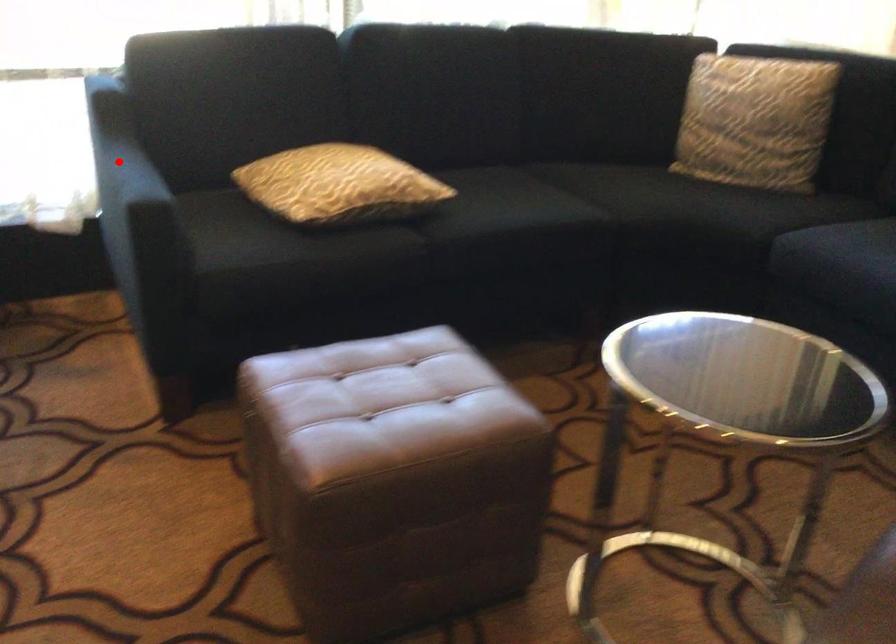
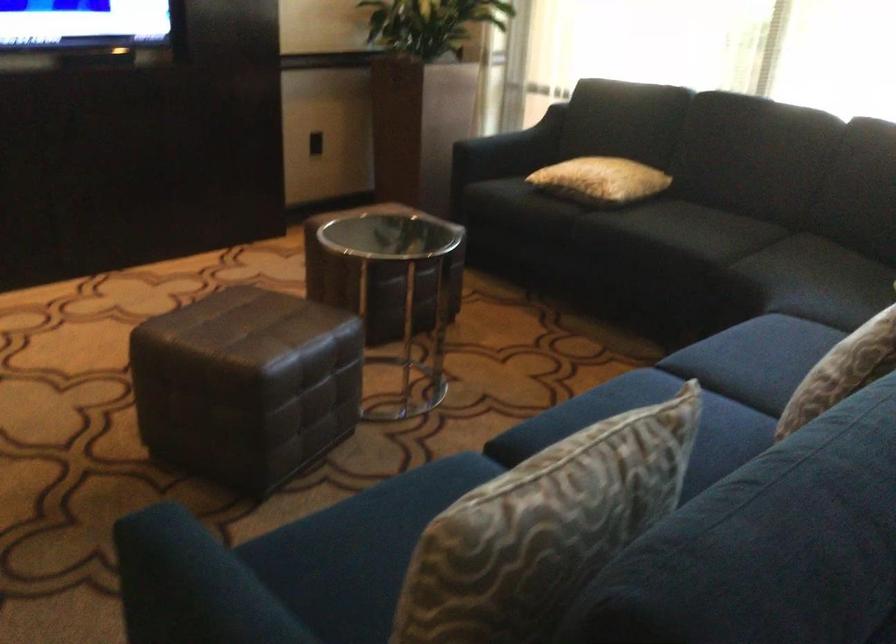
The point at the highlighted location is marked in the first image. Where is the corresponding point in the second image?

(506, 128)